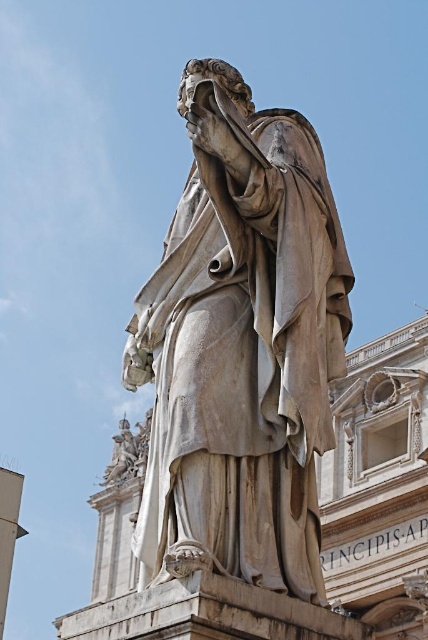
You are an art student analyzing the statue from a specific viewpoint. You notice two points on the statue labeled as point (x=199, y=189) and point (x=140, y=470). Which of these two points is nearer to your current position?

Point (x=199, y=189) is closer to the camera than point (x=140, y=470), so the point (x=199, y=189) is nearer to your current position.

Looking at this image, you are an art student observing the classical statue in the image. You need to sketch the statue accurately. The statue is represented by a point at coordinates point (240, 346). Which direction should you focus on to capture the statue in your drawing?

The white marble statue at center is represented by point (240, 346), so you should focus on the center of the image to capture the statue in your drawing.